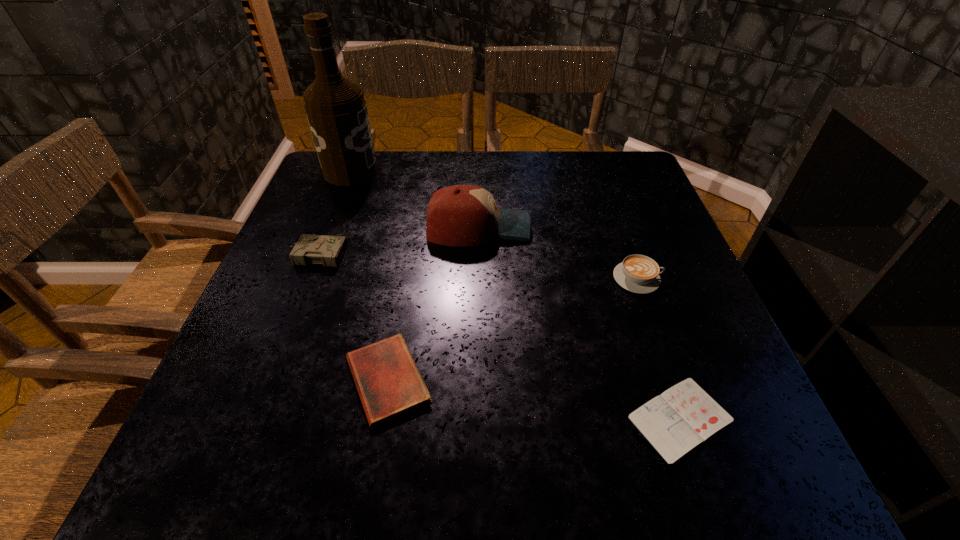
Where is `the tallest object`? The image size is (960, 540). the tallest object is located at coordinates tap(336, 110).

Identify the location of the farthest object. (336, 110).

Find the location of a particular element. The height and width of the screenshot is (540, 960). the second tallest object is located at coordinates (461, 215).

At what (x,y) coordinates should I click in order to perform the action: click on cappuccino. Please return your answer as a coordinate pair (x, y). Looking at the image, I should click on (637, 273).

This screenshot has height=540, width=960. In order to click on the tallest diary in this screenshot , I will do `click(310, 249)`.

Identify the location of the farthest diary. (310, 249).

This screenshot has width=960, height=540. I want to click on the second diary from right to left, so click(x=389, y=383).

Image resolution: width=960 pixels, height=540 pixels. I want to click on the second tallest diary, so click(389, 383).

Where is `the shortest diary`? The width and height of the screenshot is (960, 540). the shortest diary is located at coordinates (682, 417).

This screenshot has height=540, width=960. Identify the location of the shortest object. tap(682, 417).